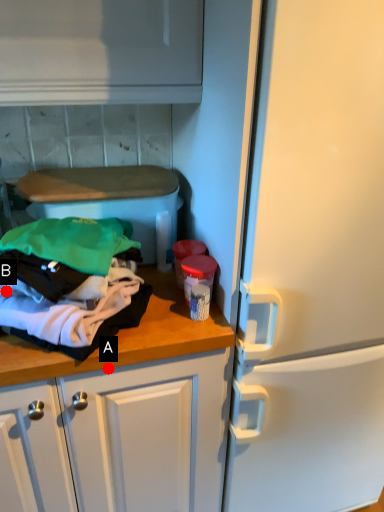
Question: Two points are circled on the image, labeled by A and B beside each circle. Which point is closer to the camera?

Choices:
 (A) A is closer
 (B) B is closer

Answer: (B)